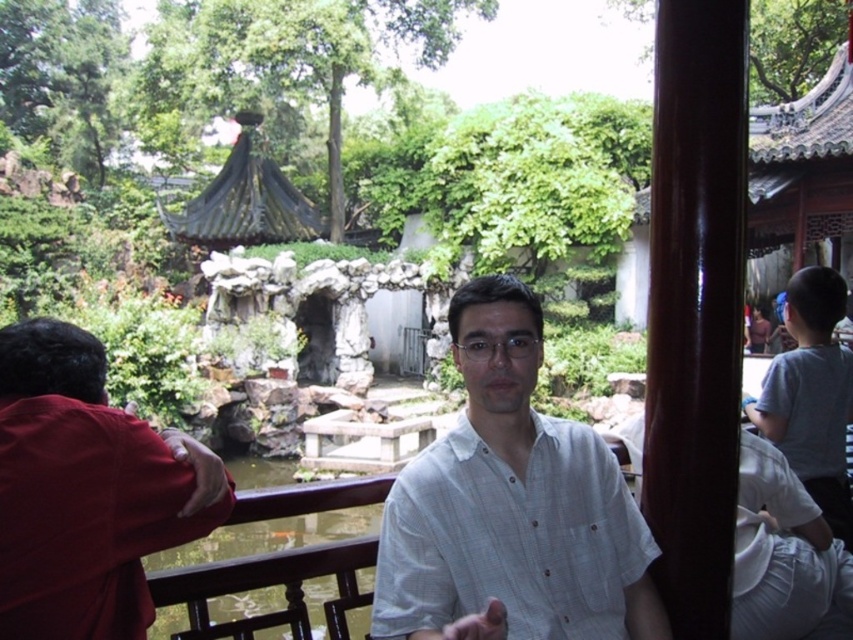
You are standing in a traditional Chinese garden and see the red matte shirt at left. If you want to take a photo of it with your camera, which has a maximum zoom range of 20 meters, will you be able to capture it clearly?

The red matte shirt at left is 21.25 meters from the camera, which exceeds the maximum zoom range of 20 meters. Therefore, you won

You are a photographer trying to capture both the white textured shirt at center and the gray cotton shirt at right in a single shot. Based on their positions, which shirt should you focus on first to ensure both are in frame?

The white textured shirt at center is positioned under the gray cotton shirt at right, so you should focus on the gray cotton shirt at right first to ensure both are in frame.